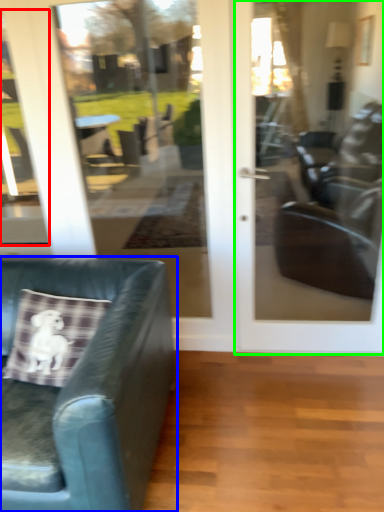
Question: Based on their relative distances, which object is farther from window (highlighted by a red box)? Choose from chair (highlighted by a blue box) and door (highlighted by a green box).

Choices:
 (A) chair
 (B) door

Answer: (B)